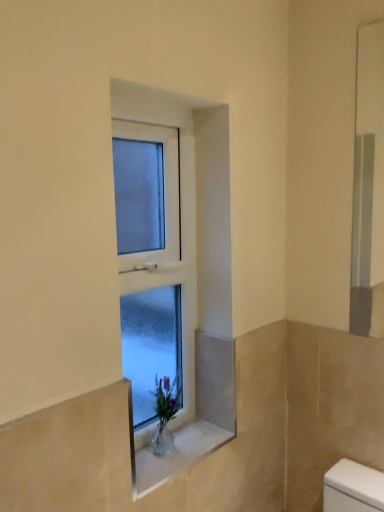
Where is `free location above clear glass vase at center (from a real-world perspective)`? free location above clear glass vase at center (from a real-world perspective) is located at coordinates (179, 445).